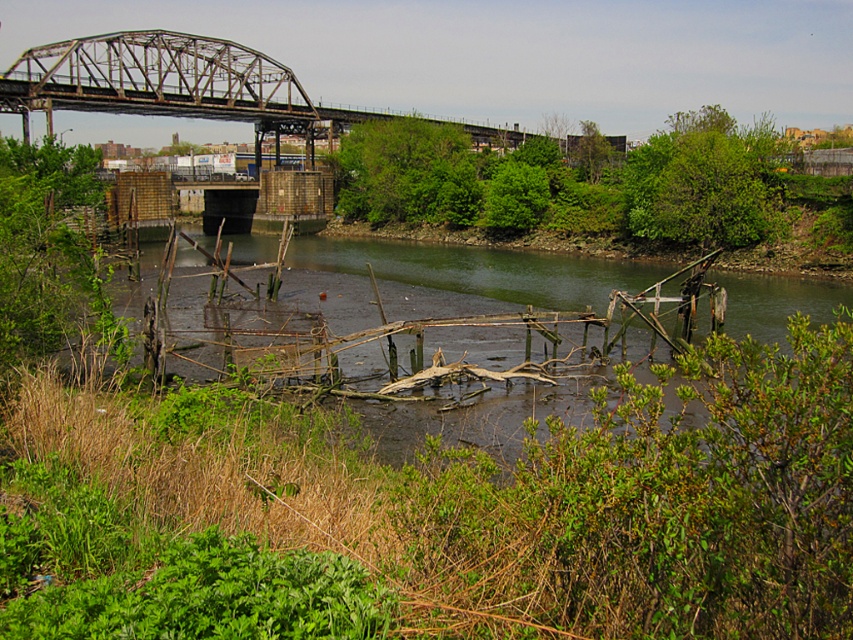
Is the position of green leafy trees at upper center less distant than that of brown wooden debris at center?

No, it is not.

Is point (787, 193) closer to camera compared to point (555, 273)?

No.

Which is behind, point (566, 172) or point (786, 291)?

Point (566, 172)

I want to click on green leafy trees at upper center, so click(587, 182).

Is rusty metal bridge at upper center further to the viewer compared to brown wooden debris at center?

Yes, rusty metal bridge at upper center is further from the viewer.

Image resolution: width=853 pixels, height=640 pixels. In order to click on rusty metal bridge at upper center in this screenshot , I will do `click(165, 83)`.

Which is behind, point (350, 112) or point (404, 276)?

The point (350, 112) is more distant.

This screenshot has width=853, height=640. Identify the location of rusty metal bridge at upper center. (165, 83).

Is green leafy trees at upper center smaller than rusty metal bridge at upper center?

Yes, green leafy trees at upper center is smaller than rusty metal bridge at upper center.

Can you confirm if green leafy trees at upper center is wider than rusty metal bridge at upper center?

No, green leafy trees at upper center is not wider than rusty metal bridge at upper center.

Find the location of `green leafy trees at upper center`. green leafy trees at upper center is located at coordinates (587, 182).

At what (x,y) coordinates should I click in order to perform the action: click on green leafy trees at upper center. Please return your answer as a coordinate pair (x, y). The width and height of the screenshot is (853, 640). Looking at the image, I should click on (587, 182).